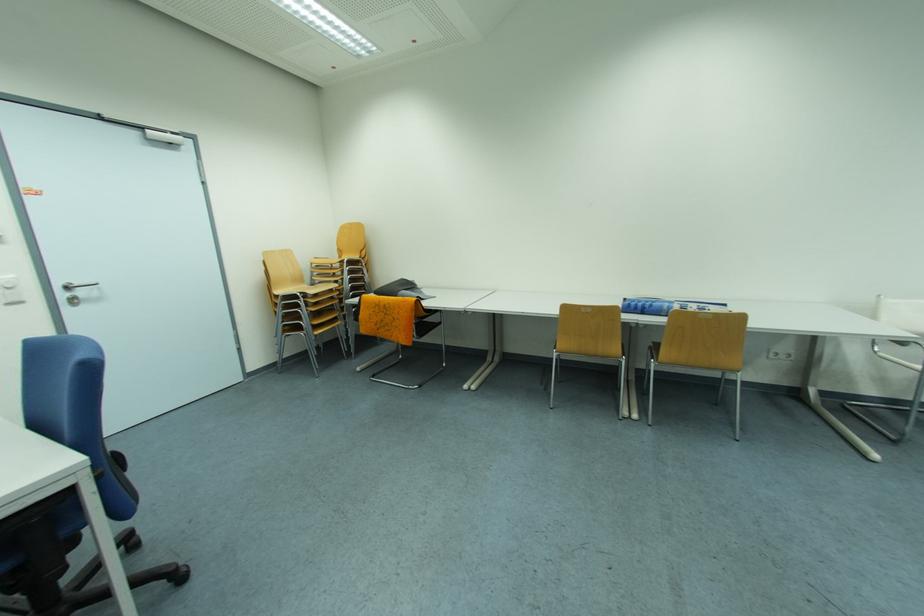
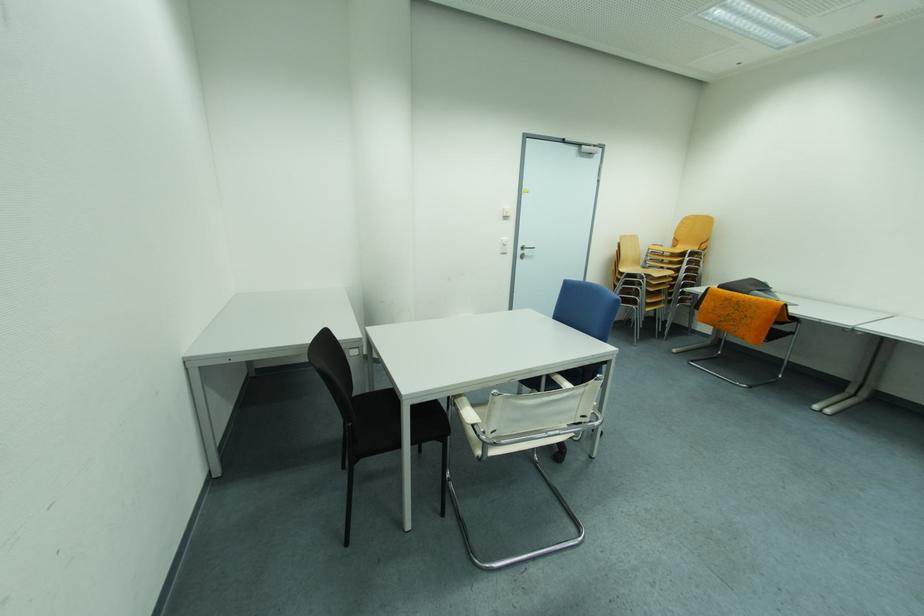
Locate, in the second image, the point that corresponds to point 341,270 in the first image.

(671, 257)